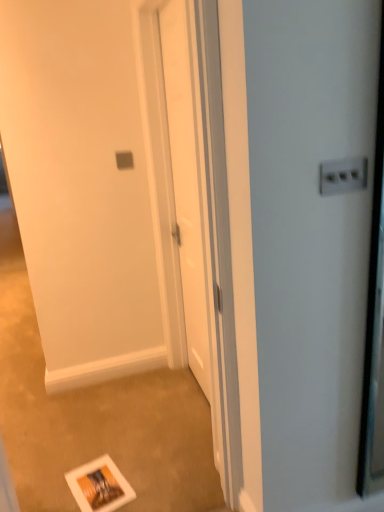
Question: Can you confirm if white matte postcard at lower center is smaller than white glossy screen door at lower center, the 2th screen door in the back-to-front sequence?

Choices:
 (A) yes
 (B) no

Answer: (A)

Question: Is white matte postcard at lower center oriented towards white glossy screen door at lower center, the 2th screen door in the back-to-front sequence?

Choices:
 (A) yes
 (B) no

Answer: (B)

Question: From the image's perspective, is white matte postcard at lower center below white glossy screen door at lower center, which appears as the first screen door when viewed from the front?

Choices:
 (A) yes
 (B) no

Answer: (A)

Question: Considering the relative sizes of white matte postcard at lower center and white glossy screen door at lower center, the 2th screen door in the back-to-front sequence, in the image provided, is white matte postcard at lower center shorter than white glossy screen door at lower center, the 2th screen door in the back-to-front sequence,?

Choices:
 (A) yes
 (B) no

Answer: (A)

Question: Is white glossy screen door at lower center, the 2th screen door in the back-to-front sequence, surrounded by white matte postcard at lower center?

Choices:
 (A) yes
 (B) no

Answer: (B)

Question: Based on their sizes in the image, would you say white glossy screen door at lower center, which appears as the first screen door when viewed from the front, is bigger or smaller than white plastic electric outlet at upper right?

Choices:
 (A) small
 (B) big

Answer: (B)

Question: In terms of height, does white glossy screen door at lower center, which appears as the first screen door when viewed from the front, look taller or shorter compared to white plastic electric outlet at upper right?

Choices:
 (A) tall
 (B) short

Answer: (A)

Question: Does point (147, 276) appear closer or farther from the camera than point (349, 176)?

Choices:
 (A) farther
 (B) closer

Answer: (A)

Question: From the image's perspective, relative to white plastic electric outlet at upper right, is white glossy screen door at lower center, the 2th screen door in the back-to-front sequence, above or below?

Choices:
 (A) below
 (B) above

Answer: (A)

Question: Considering the positions of white glossy door at center, positioned as the 2th screen door in front-to-back order, and white plastic electric outlet at upper right in the image, is white glossy door at center, positioned as the 2th screen door in front-to-back order, wider or thinner than white plastic electric outlet at upper right?

Choices:
 (A) wide
 (B) thin

Answer: (A)

Question: Is white glossy door at center, positioned as the 2th screen door in front-to-back order, bigger or smaller than white plastic electric outlet at upper right?

Choices:
 (A) small
 (B) big

Answer: (B)

Question: From the image's perspective, is white glossy door at center, positioned as the 2th screen door in front-to-back order, above or below white plastic electric outlet at upper right?

Choices:
 (A) below
 (B) above

Answer: (A)

Question: Is white glossy door at center, which is the 1th screen door in back-to-front order, to the left or to the right of white plastic electric outlet at upper right in the image?

Choices:
 (A) right
 (B) left

Answer: (B)

Question: From a real-world perspective, relative to white glossy door at center, which is the 1th screen door in back-to-front order, is white plastic electric outlet at upper right vertically above or below?

Choices:
 (A) below
 (B) above

Answer: (B)

Question: Is point (332, 184) closer or farther from the camera than point (152, 28)?

Choices:
 (A) closer
 (B) farther

Answer: (A)